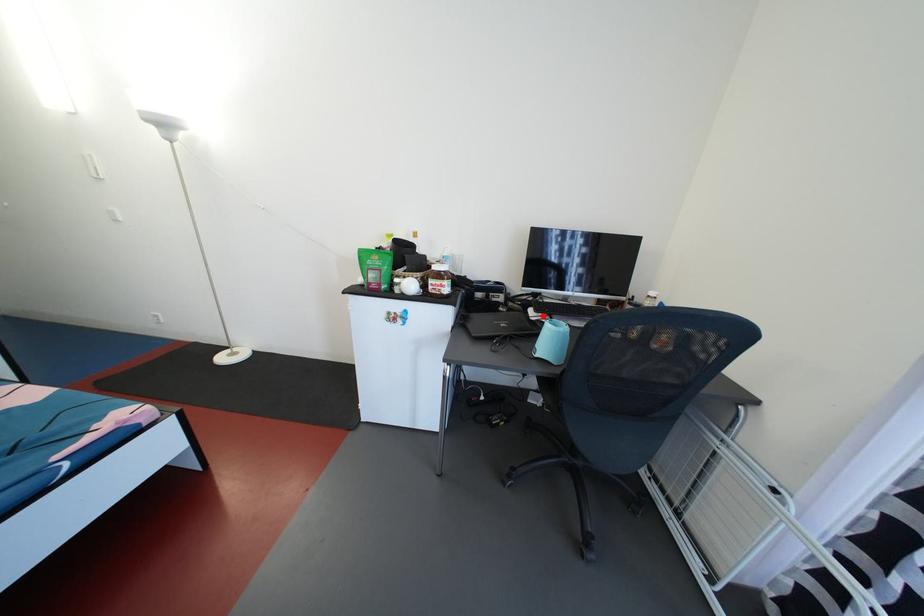
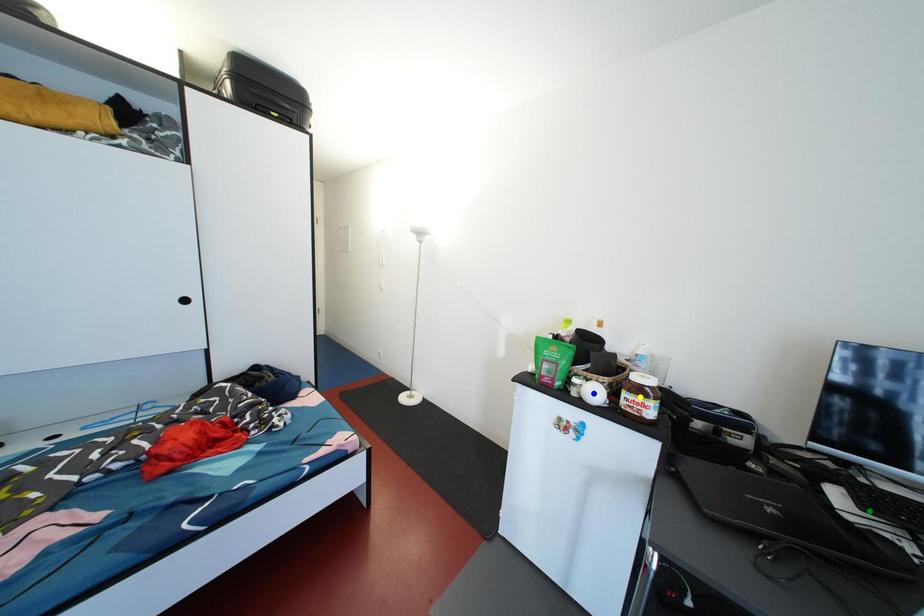
Question: I am providing you with two images of the same scene from different viewpoints. A red point is marked on the first image. You are given multiple points on the second image. Which point in image 2 is actually the same real-world point as the red point in image 1?

Choices:
 (A) blue point
 (B) green point
 (C) yellow point

Answer: (B)